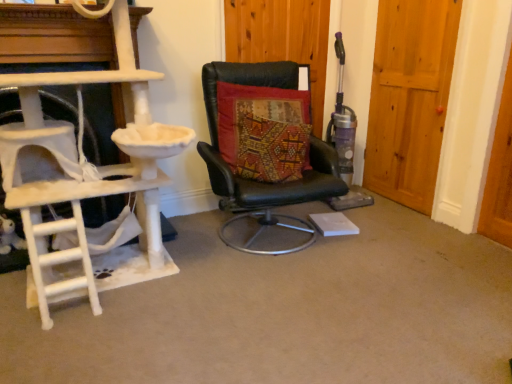
Where is `vacant region in front of black leather chair at center`? vacant region in front of black leather chair at center is located at coordinates (268, 301).